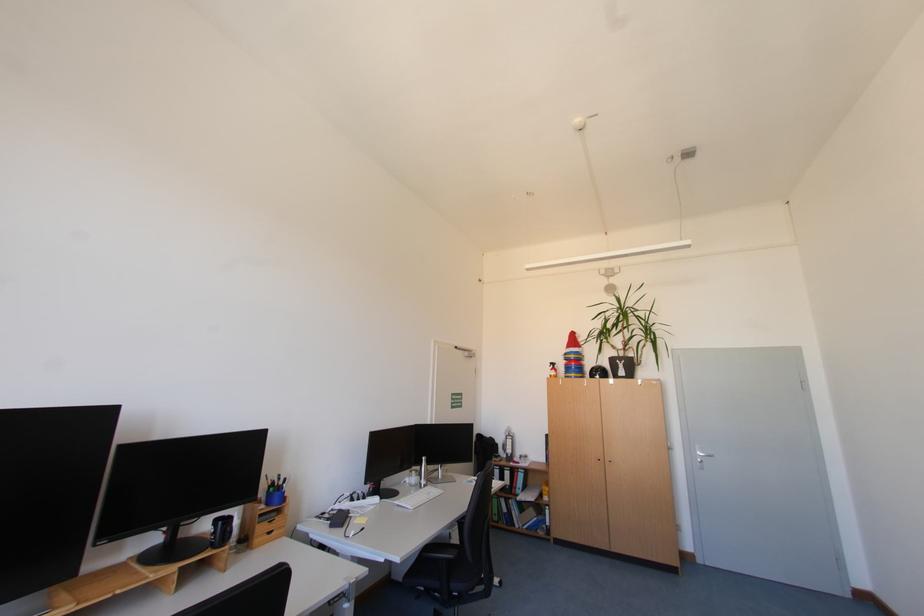
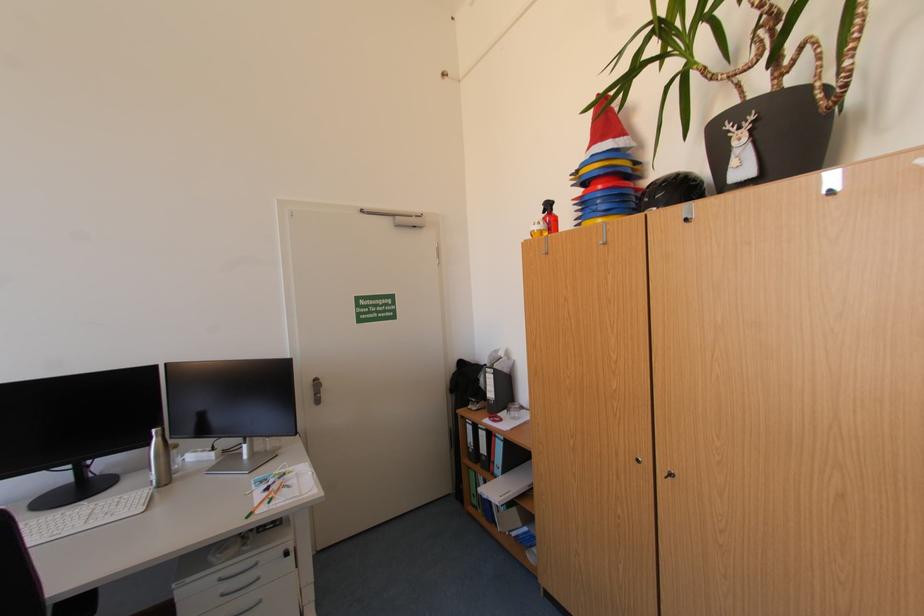
Where in the second image is the point corresponding to the point at 581,369 from the first image?

(606, 203)